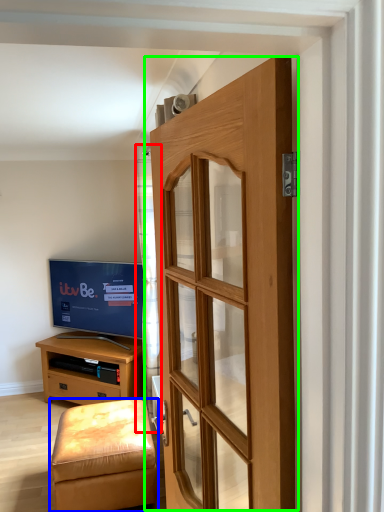
Question: Which is nearer to the curtain (highlighted by a red box)? stool (highlighted by a blue box) or door (highlighted by a green box).

Choices:
 (A) stool
 (B) door

Answer: (A)